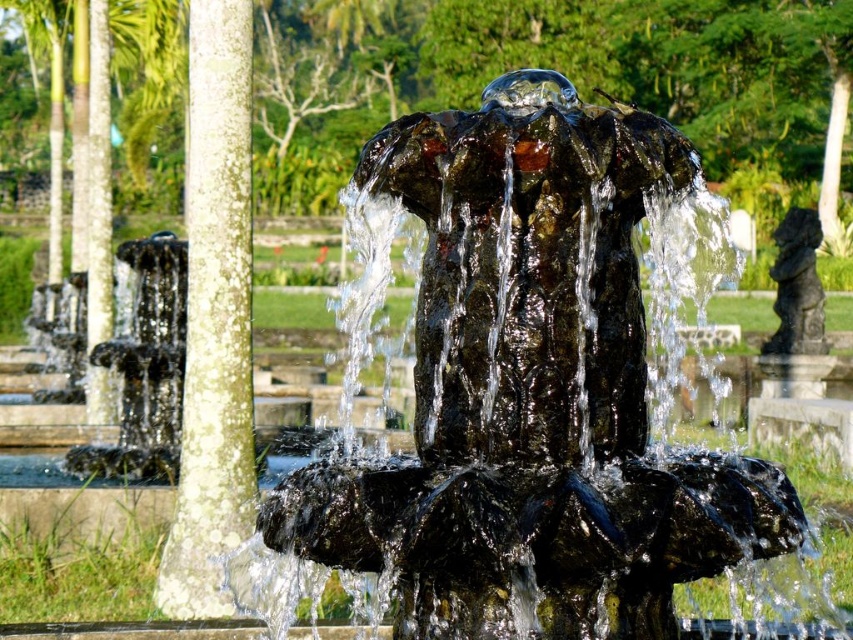
Question: Which point is closer to the camera?

Choices:
 (A) (390, 134)
 (B) (787, 332)
 (C) (99, 157)

Answer: (A)

Question: Where is white lichen-covered pillar at left located in relation to black stone statue at right in the image?

Choices:
 (A) left
 (B) right

Answer: (A)

Question: Observing the image, what is the correct spatial positioning of white lichen-covered pillar at left in reference to black stone statue at right?

Choices:
 (A) right
 (B) left

Answer: (B)

Question: Which object is positioned farthest from the black stone statue at right?

Choices:
 (A) black stone pillar at left
 (B) black stone fountain at center
 (C) white lichen-covered pillar at left

Answer: (B)

Question: Which point is farther to the camera?

Choices:
 (A) (102, 406)
 (B) (236, 45)
 (C) (776, 280)
 (D) (424, 166)

Answer: (C)

Question: Is black stone fountain at center bigger than black stone pillar at left?

Choices:
 (A) no
 (B) yes

Answer: (B)